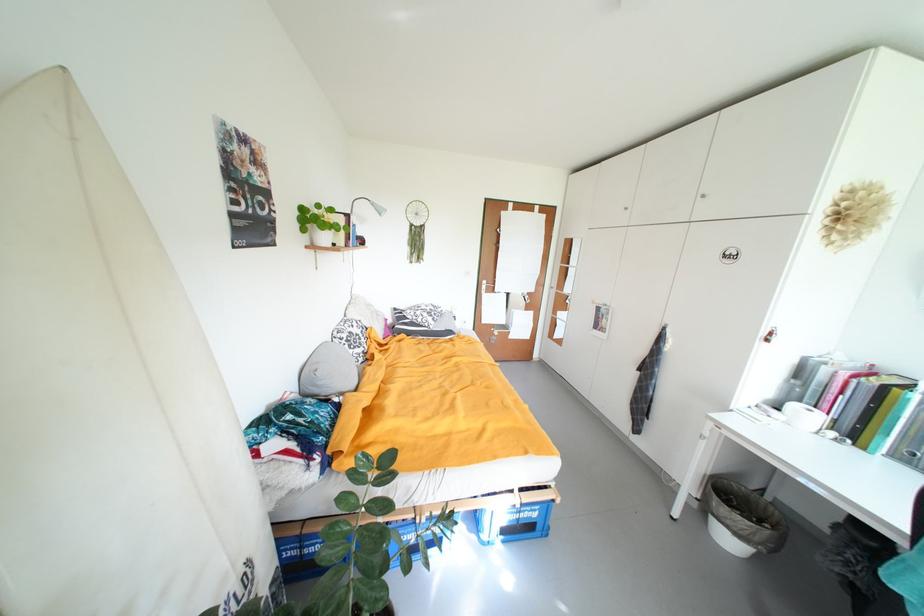
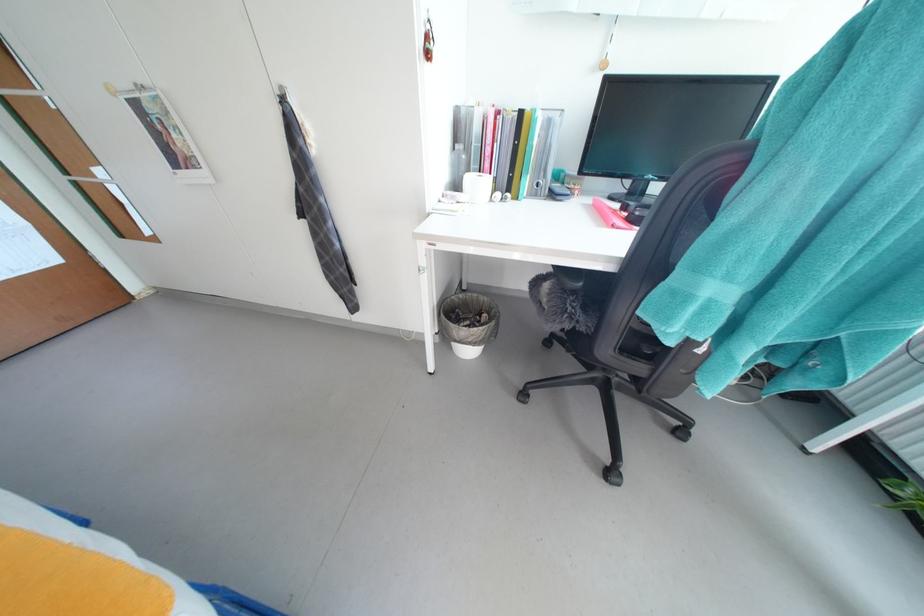
Find the pixel in the second image that matches the point at 736,525 in the first image.

(478, 342)